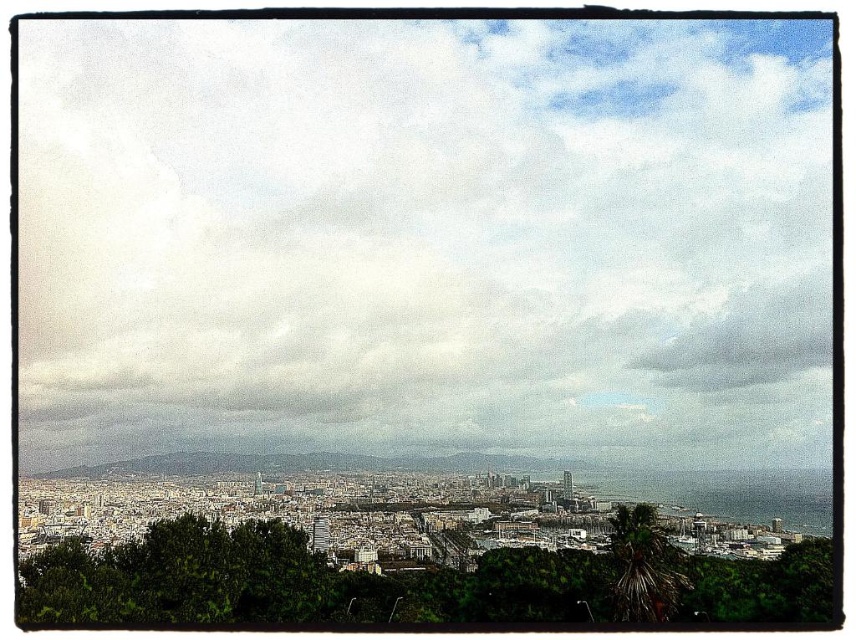
Question: Does cloudy sky at upper center have a smaller size compared to green leafy tree at center?

Choices:
 (A) no
 (B) yes

Answer: (A)

Question: Which of the following is the closest to the observer?

Choices:
 (A) cloudy sky at upper center
 (B) green leafy tree at center

Answer: (A)

Question: Which object appears farthest from the camera in this image?

Choices:
 (A) cloudy sky at upper center
 (B) green leafy palm at lower right

Answer: (B)

Question: Estimate the real-world distances between objects in this image. Which object is closer to the green leafy tree at center?

Choices:
 (A) cloudy sky at upper center
 (B) green leafy palm at lower right

Answer: (B)

Question: Does green leafy tree at center have a lesser width compared to green leafy palm at lower right?

Choices:
 (A) no
 (B) yes

Answer: (A)

Question: Is green leafy tree at center positioned in front of green leafy palm at lower right?

Choices:
 (A) yes
 (B) no

Answer: (A)